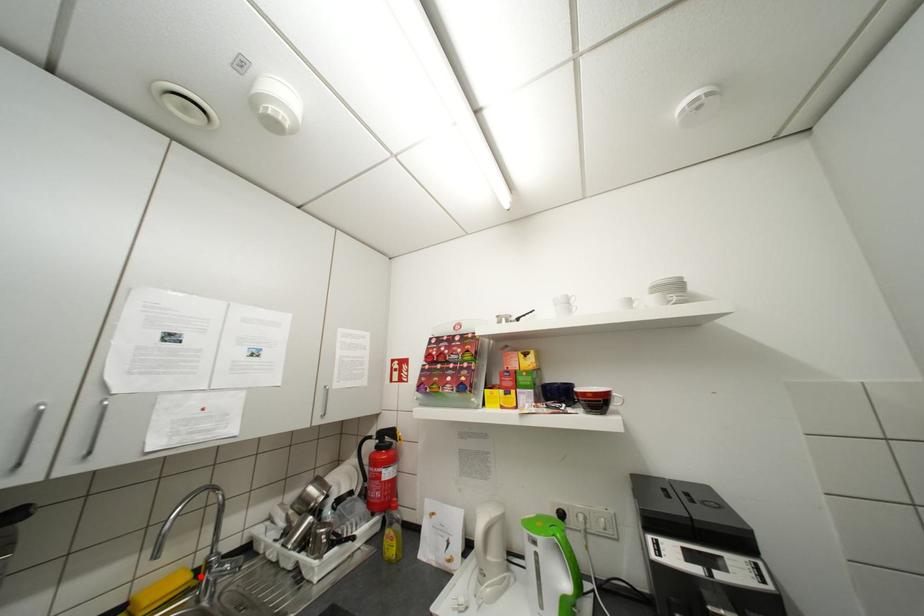
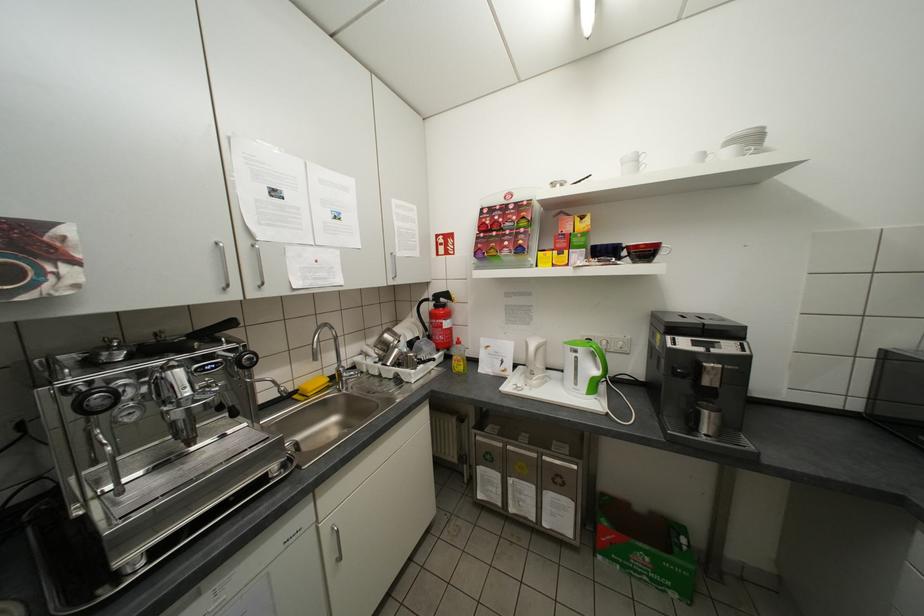
The point at the highlighted location is marked in the first image. Where is the corresponding point in the second image?

(336, 379)